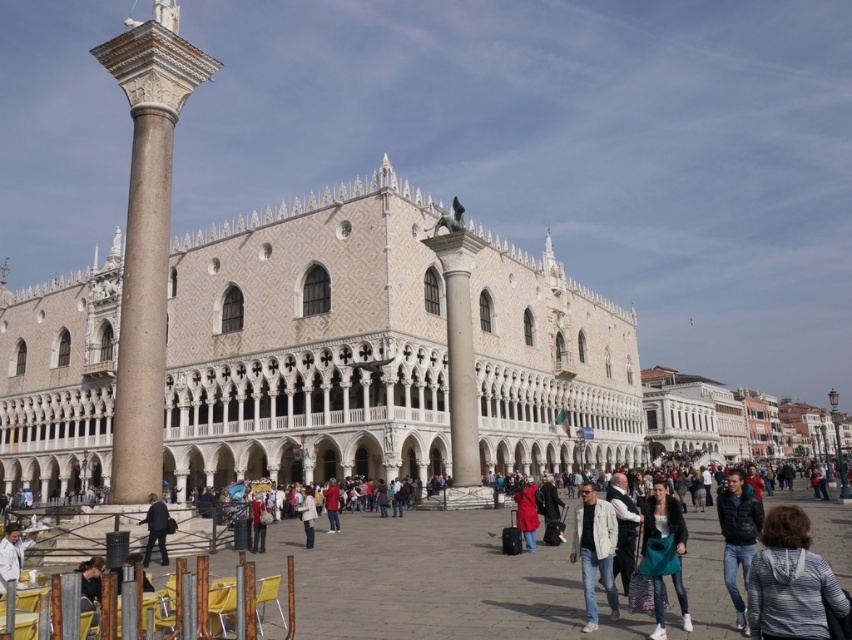
You are a GUI agent. You are given a task and a screenshot of the screen. Output one action in this format:
    pyautogui.click(x=<x>, y=<y>)
    Task: Click on the white textured stone building at center
    The image size is (852, 640).
    Given the screenshot: What is the action you would take?
    pyautogui.click(x=308, y=342)

Is point (274, 353) positioned before point (686, 536)?

No, (274, 353) is further to viewer.

Find the location of a particular element. This screenshot has width=852, height=640. white textured stone building at center is located at coordinates (308, 342).

Can you confirm if smooth stone column at center is wider than matte red coat at center?

Correct, the width of smooth stone column at center exceeds that of matte red coat at center.

Who is positioned more to the right, smooth stone column at center or matte red coat at center?

matte red coat at center is more to the right.

Is point (448, 380) farther from camera compared to point (532, 515)?

That is True.

The width and height of the screenshot is (852, 640). What are the coordinates of `smooth stone column at center` in the screenshot? It's located at (459, 352).

Is white textured stone building at center to the left of leather jacket at lower right from the viewer's perspective?

Indeed, white textured stone building at center is positioned on the left side of leather jacket at lower right.

Does white textured stone building at center appear over leather jacket at lower right?

Correct, white textured stone building at center is located above leather jacket at lower right.

Measure the distance between white textured stone building at center and camera.

The distance of white textured stone building at center from camera is 42.38 meters.

Find the location of a particular element. The image size is (852, 640). white textured stone building at center is located at coordinates (308, 342).